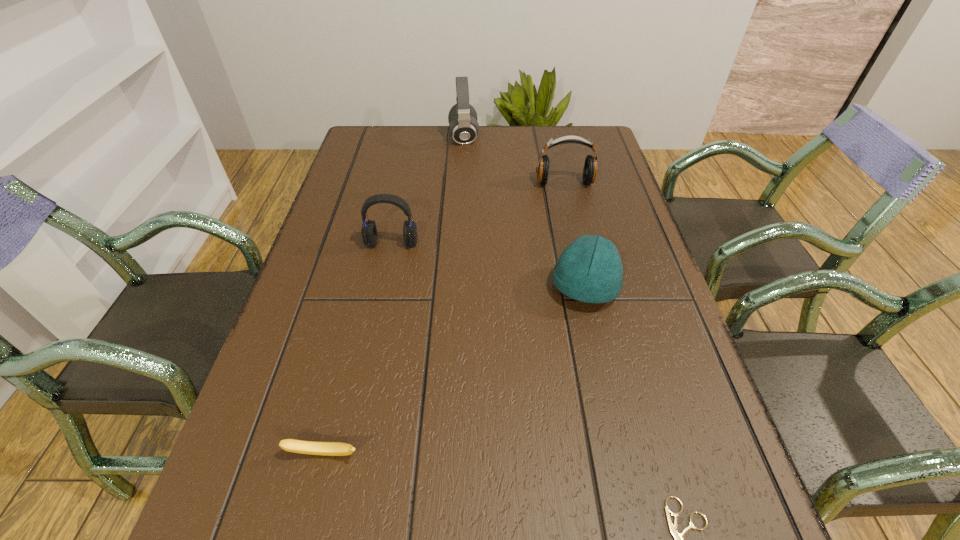
At what (x,y) coordinates should I click in order to perform the action: click on vacant space located 0.170m on the ear cups of the farthest object. Please return your answer as a coordinate pair (x, y). The width and height of the screenshot is (960, 540). Looking at the image, I should click on (531, 138).

Locate an element on the screen. This screenshot has width=960, height=540. vacant area located 0.320m on the ear cups of the rightmost headset is located at coordinates coord(585,269).

At what (x,y) coordinates should I click in order to perform the action: click on free space located 0.130m on the headband of the third farthest object. Please return your answer as a coordinate pair (x, y). Image resolution: width=960 pixels, height=540 pixels. Looking at the image, I should click on (382, 291).

Where is `vacant space located on the left of the third shortest object`? The image size is (960, 540). vacant space located on the left of the third shortest object is located at coordinates click(x=409, y=287).

Where is `free space located 0.060m at the stem of the second nearest object`? The height and width of the screenshot is (540, 960). free space located 0.060m at the stem of the second nearest object is located at coordinates (312, 502).

The image size is (960, 540). In order to click on object positioned at the far edge in this screenshot , I will do `click(463, 127)`.

Locate an element on the screen. This screenshot has height=540, width=960. headset present at the left edge is located at coordinates 369,233.

Identify the location of banana that is positioned at the left edge. (291, 445).

This screenshot has height=540, width=960. What are the coordinates of `headset located in the right edge section of the desktop` in the screenshot? It's located at (590, 167).

At what (x,y) coordinates should I click in order to perform the action: click on beanie that is at the right edge. Please return your answer as a coordinate pair (x, y). Looking at the image, I should click on (590, 270).